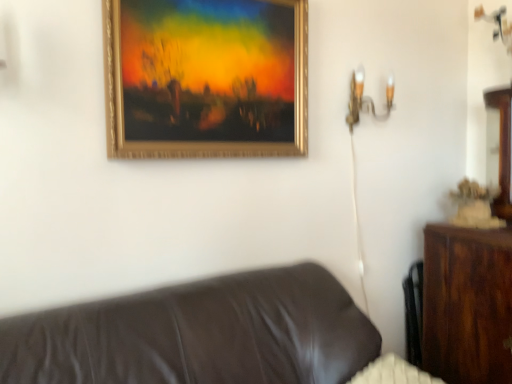
Question: From the image's perspective, relative to gold metallic picture frame at upper center, is brown leather couch at lower left above or below?

Choices:
 (A) below
 (B) above

Answer: (A)

Question: Is point (147, 334) positioned closer to the camera than point (250, 0)?

Choices:
 (A) closer
 (B) farther

Answer: (A)

Question: Estimate the real-world distances between objects in this image. Which object is closer to the gold metallic wall sconce at upper right?

Choices:
 (A) gold metallic picture frame at upper center
 (B) brown leather couch at lower left

Answer: (A)

Question: Which object is the closest to the brown leather couch at lower left?

Choices:
 (A) gold metallic picture frame at upper center
 (B) gold metallic wall sconce at upper right

Answer: (A)